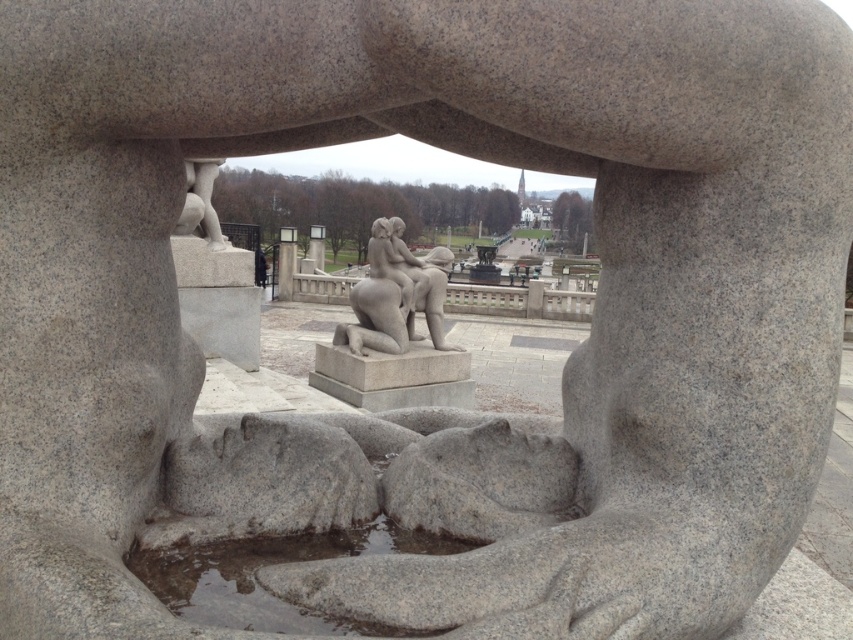
Question: Which of the following is the farthest from the observer?

Choices:
 (A) (386, 244)
 (B) (225, 576)

Answer: (A)

Question: Is transparent stone puddle at lower center above gray stone sculpture at center?

Choices:
 (A) yes
 (B) no

Answer: (B)

Question: Does transparent stone puddle at lower center have a lesser width compared to gray stone sculpture at center?

Choices:
 (A) no
 (B) yes

Answer: (B)

Question: Which of the following is the farthest from the observer?

Choices:
 (A) gray stone sculpture at center
 (B) transparent stone puddle at lower center

Answer: (A)

Question: Is transparent stone puddle at lower center to the right of gray stone sculpture at center from the viewer's perspective?

Choices:
 (A) yes
 (B) no

Answer: (A)

Question: Which of the following is the farthest from the observer?

Choices:
 (A) transparent stone puddle at lower center
 (B) gray stone sculpture at center

Answer: (B)